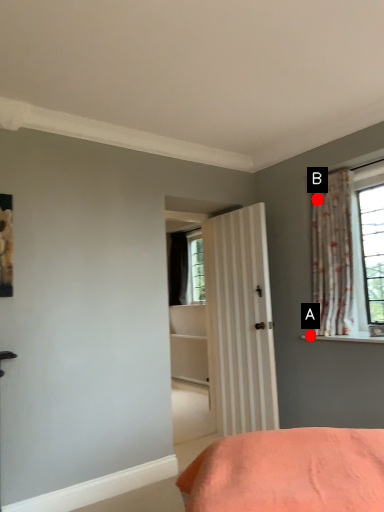
Question: Two points are circled on the image, labeled by A and B beside each circle. Among these points, which one is farthest from the camera?

Choices:
 (A) A is further
 (B) B is further

Answer: (B)